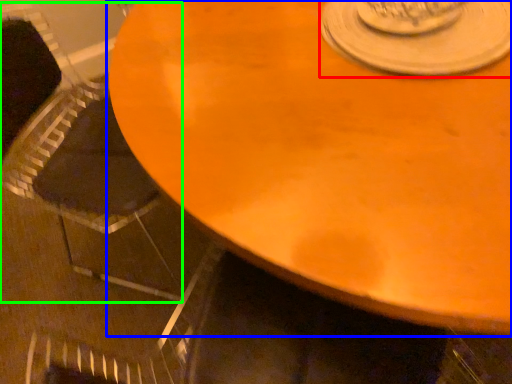
Question: Which is nearer to the saucer (highlighted by a red box)? table (highlighted by a blue box) or armchair (highlighted by a green box).

Choices:
 (A) table
 (B) armchair

Answer: (A)